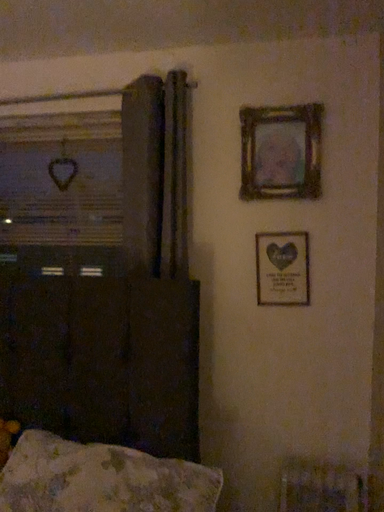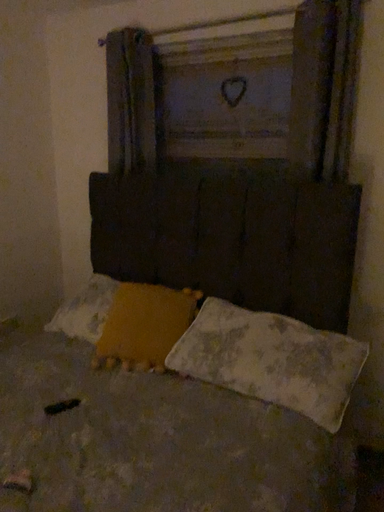
Question: How did the camera likely rotate when shooting the video?

Choices:
 (A) rotated downward
 (B) rotated upward

Answer: (A)